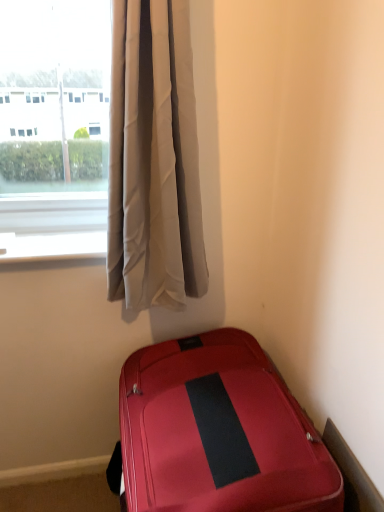
Question: Based on their sizes in the image, would you say silky white curtains at upper left is bigger or smaller than shiny red suitcase at lower right?

Choices:
 (A) big
 (B) small

Answer: (B)

Question: Looking at their shapes, would you say silky white curtains at upper left is wider or thinner than shiny red suitcase at lower right?

Choices:
 (A) thin
 (B) wide

Answer: (A)

Question: From a real-world perspective, is silky white curtains at upper left positioned above or below shiny red suitcase at lower right?

Choices:
 (A) above
 (B) below

Answer: (A)

Question: Would you say shiny red suitcase at lower right is to the left or to the right of silky white curtains at upper left in the picture?

Choices:
 (A) left
 (B) right

Answer: (B)

Question: From the image's perspective, relative to silky white curtains at upper left, is shiny red suitcase at lower right above or below?

Choices:
 (A) below
 (B) above

Answer: (A)

Question: In terms of width, does shiny red suitcase at lower right look wider or thinner when compared to silky white curtains at upper left?

Choices:
 (A) wide
 (B) thin

Answer: (A)

Question: Looking at the image, does shiny red suitcase at lower right seem bigger or smaller compared to silky white curtains at upper left?

Choices:
 (A) small
 (B) big

Answer: (B)